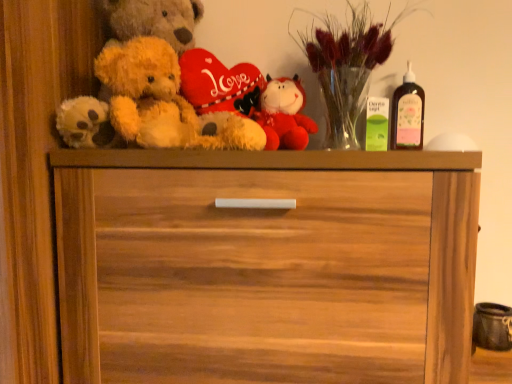
In order to click on translucent glass vase at upper right in this screenshot , I will do `click(346, 66)`.

Measure the distance between fluffy red plush toy at center and camera.

fluffy red plush toy at center is 1.06 meters away from camera.

At what (x,y) coordinates should I click in order to perform the action: click on pink glass bottle at upper right. Please return your answer as a coordinate pair (x, y). Looking at the image, I should click on (407, 114).

Image resolution: width=512 pixels, height=384 pixels. Describe the element at coordinates (407, 114) in the screenshot. I see `pink glass bottle at upper right` at that location.

You are a GUI agent. You are given a task and a screenshot of the screen. Output one action in this format:
    pyautogui.click(x=<x>, y=<y>)
    Task: Click on the translucent glass vase at upper right
    
    Given the screenshot: What is the action you would take?
    pyautogui.click(x=346, y=66)

How different are the orientations of fluffy red plush toy at center and pink glass bottle at upper right in degrees?

The facing directions of fluffy red plush toy at center and pink glass bottle at upper right are 2.61 degrees apart.

Would you consider fluffy red plush toy at center to be distant from pink glass bottle at upper right?

fluffy red plush toy at center is near pink glass bottle at upper right, not far away.

Which object is further away from the camera, fluffy red plush toy at center or pink glass bottle at upper right?

pink glass bottle at upper right is further away from the camera.

Which is more to the right, fluffy red plush toy at center or pink glass bottle at upper right?

Positioned to the right is pink glass bottle at upper right.

Does fluffy beige teddy bear at left appear on the right side of pink glass bottle at upper right?

No, fluffy beige teddy bear at left is not to the right of pink glass bottle at upper right.

Is fluffy beige teddy bear at left surrounding pink glass bottle at upper right?

No, pink glass bottle at upper right is located outside of fluffy beige teddy bear at left.

From the image's perspective, which is above, fluffy beige teddy bear at left or pink glass bottle at upper right?

fluffy beige teddy bear at left, from the image's perspective.

Is pink glass bottle at upper right oriented towards wooden chest of drawers at center?

No, pink glass bottle at upper right is not aimed at wooden chest of drawers at center.

Which of these two, pink glass bottle at upper right or wooden chest of drawers at center, stands taller?

Standing taller between the two is wooden chest of drawers at center.

Between pink glass bottle at upper right and wooden chest of drawers at center, which one is positioned behind?

pink glass bottle at upper right is further from the camera.

Who is smaller, pink glass bottle at upper right or wooden chest of drawers at center?

pink glass bottle at upper right is smaller.

Is fluffy red plush toy at center far from wooden chest of drawers at center?

No, there isn't a large distance between fluffy red plush toy at center and wooden chest of drawers at center.

Is fluffy red plush toy at center not within wooden chest of drawers at center?

Yes, fluffy red plush toy at center is located beyond the bounds of wooden chest of drawers at center.

Which is more to the right, fluffy red plush toy at center or wooden chest of drawers at center?

Positioned to the right is fluffy red plush toy at center.

Based on the photo, from a real-world perspective, between fluffy red plush toy at center and translucent glass vase at upper right, who is vertically lower?

fluffy red plush toy at center is physically lower.

Considering the relative sizes of fluffy red plush toy at center and translucent glass vase at upper right in the image provided, is fluffy red plush toy at center shorter than translucent glass vase at upper right?

Yes, fluffy red plush toy at center is shorter than translucent glass vase at upper right.

From the image's perspective, relative to translucent glass vase at upper right, is fluffy red plush toy at center above or below?

Answer: fluffy red plush toy at center is below translucent glass vase at upper right.

At what (x,y) coordinates should I click in order to perform the action: click on toy in front of the pink glass bottle at upper right. Please return your answer as a coordinate pair (x, y). This screenshot has width=512, height=384. Looking at the image, I should click on (284, 114).

Is pink glass bottle at upper right facing towards fluffy red plush toy at center?

No, pink glass bottle at upper right is not aimed at fluffy red plush toy at center.

How different are the orientations of pink glass bottle at upper right and fluffy red plush toy at center in degrees?

The angular difference between pink glass bottle at upper right and fluffy red plush toy at center is 2.61 degrees.

Between point (395, 138) and point (278, 139), which one is positioned in front?

The point (278, 139) is closer to the camera.

Does translucent glass vase at upper right appear on the left side of fluffy beige teddy bear at left?

In fact, translucent glass vase at upper right is to the right of fluffy beige teddy bear at left.

Where is `floral arrangement beneath the fluffy beige teddy bear at left (from a real-world perspective)`? The height and width of the screenshot is (384, 512). floral arrangement beneath the fluffy beige teddy bear at left (from a real-world perspective) is located at coordinates (346, 66).

How much distance is there between translucent glass vase at upper right and fluffy beige teddy bear at left?

A distance of 14.65 inches exists between translucent glass vase at upper right and fluffy beige teddy bear at left.

Which of these two, translucent glass vase at upper right or fluffy beige teddy bear at left, is thinner?

translucent glass vase at upper right is thinner.

Locate an element on the screen. toy on the left side of pink glass bottle at upper right is located at coordinates (284, 114).

Image resolution: width=512 pixels, height=384 pixels. What are the coordinates of `teddy bear above the pink glass bottle at upper right (from a real-world perspective)` in the screenshot? It's located at (150, 87).

When comparing their distances from fluffy beige teddy bear at left, does pink glass bottle at upper right or wooden chest of drawers at center seem closer?

wooden chest of drawers at center is closer to fluffy beige teddy bear at left.

Based on their spatial positions, is fluffy red plush toy at center or pink glass bottle at upper right further from translucent glass vase at upper right?

Among the two, pink glass bottle at upper right is located further to translucent glass vase at upper right.

Estimate the real-world distances between objects in this image. Which object is further from fluffy red plush toy at center, wooden chest of drawers at center or translucent glass vase at upper right?

wooden chest of drawers at center is further to fluffy red plush toy at center.

Which object lies nearer to the anchor point pink glass bottle at upper right, translucent glass vase at upper right or fluffy beige teddy bear at left?

translucent glass vase at upper right is positioned closer to the anchor pink glass bottle at upper right.

Looking at the image, which one is located closer to fluffy beige teddy bear at left, wooden chest of drawers at center or fluffy red plush toy at center?

wooden chest of drawers at center lies closer to fluffy beige teddy bear at left than the other object.

Consider the image. When comparing their distances from pink glass bottle at upper right, does fluffy red plush toy at center or fluffy beige teddy bear at left seem closer?

Based on the image, fluffy red plush toy at center appears to be nearer to pink glass bottle at upper right.

In the scene shown: From the image, which object appears to be farther from fluffy beige teddy bear at left, fluffy red plush toy at center or wooden chest of drawers at center?

Based on the image, fluffy red plush toy at center appears to be further to fluffy beige teddy bear at left.

Estimate the real-world distances between objects in this image. Which object is closer to translucent glass vase at upper right, fluffy red plush toy at center or wooden chest of drawers at center?

Based on the image, fluffy red plush toy at center appears to be nearer to translucent glass vase at upper right.

The height and width of the screenshot is (384, 512). I want to click on toy situated between fluffy beige teddy bear at left and translucent glass vase at upper right from left to right, so click(x=284, y=114).

You are a GUI agent. You are given a task and a screenshot of the screen. Output one action in this format:
    pyautogui.click(x=<x>, y=<y>)
    Task: Click on the floral arrangement between fluffy red plush toy at center and pink glass bottle at upper right from left to right
    
    Given the screenshot: What is the action you would take?
    pyautogui.click(x=346, y=66)

You are a GUI agent. You are given a task and a screenshot of the screen. Output one action in this format:
    pyautogui.click(x=<x>, y=<y>)
    Task: Click on the wine bottle that lies between translucent glass vase at upper right and wooden chest of drawers at center from top to bottom
    
    Given the screenshot: What is the action you would take?
    pyautogui.click(x=407, y=114)

Locate an element on the screen. Image resolution: width=512 pixels, height=384 pixels. floral arrangement between fluffy beige teddy bear at left and pink glass bottle at upper right from left to right is located at coordinates (346, 66).